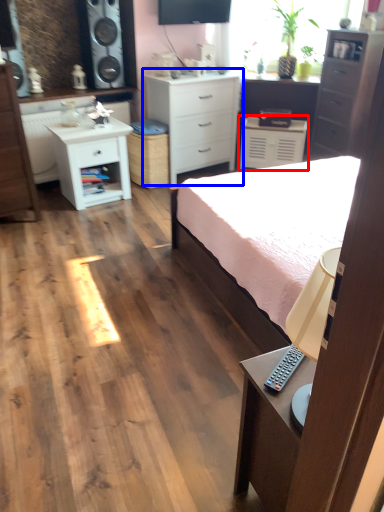
Question: Which object is closer to the camera taking this photo, cabinetry (highlighted by a red box) or chest of drawers (highlighted by a blue box)?

Choices:
 (A) cabinetry
 (B) chest of drawers

Answer: (B)